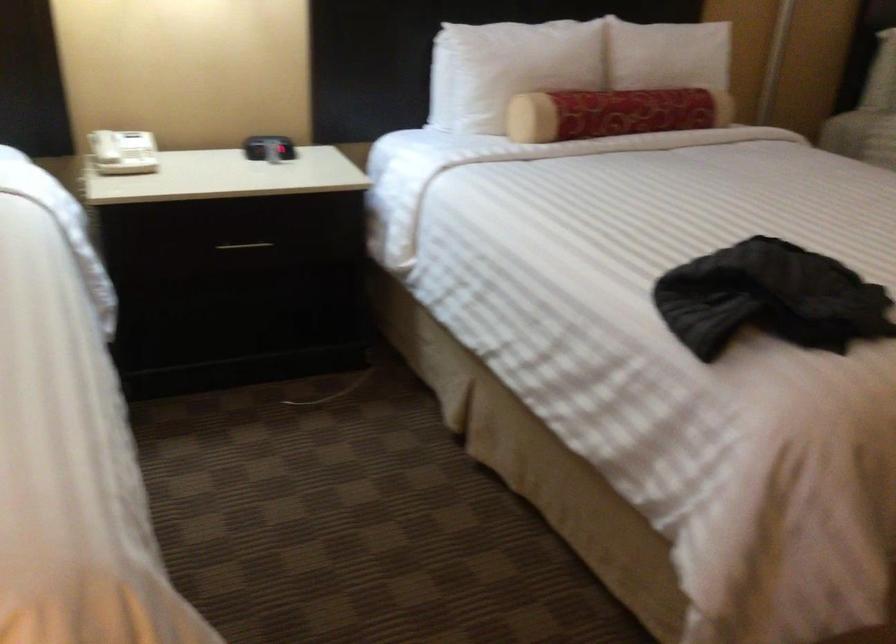
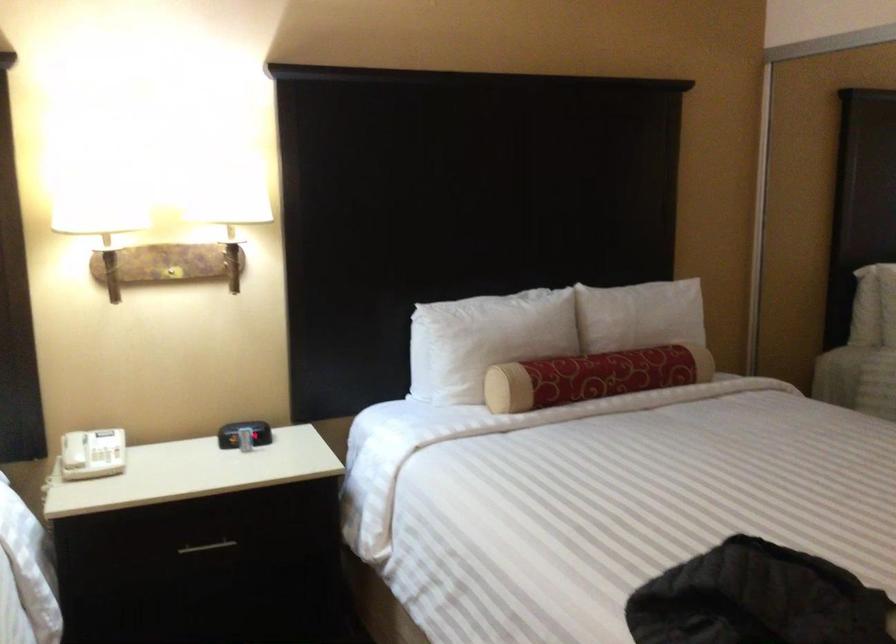
The point at (621, 109) is marked in the first image. Where is the corresponding point in the second image?

(592, 377)